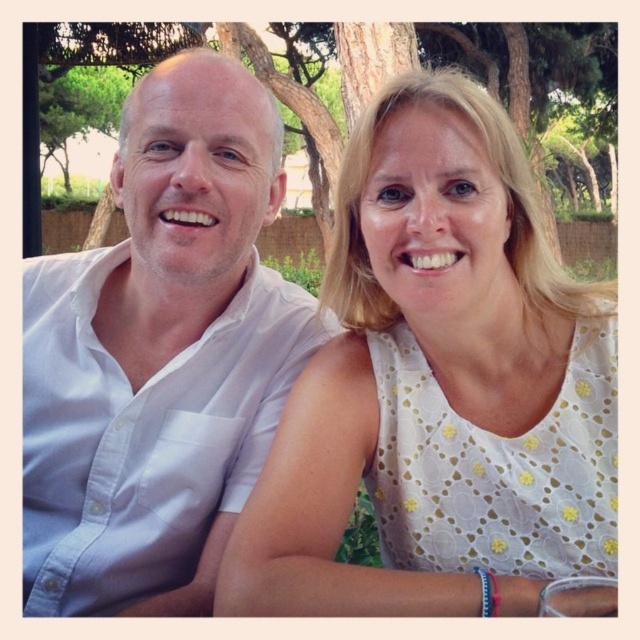
Is white cotton shirt at left to the left of green leafy tree at upper center from the viewer's perspective?

Yes, white cotton shirt at left is to the left of green leafy tree at upper center.

Is point (131, 148) in front of point (536, 150)?

Yes, point (131, 148) is in front of point (536, 150).

Identify the location of white cotton shirt at left. The image size is (640, 640). (160, 355).

Can you confirm if white dotted dress at center is positioned below white cotton shirt at left?

Indeed, white dotted dress at center is positioned under white cotton shirt at left.

Who is higher up, white dotted dress at center or white cotton shirt at left?

white cotton shirt at left is above.

At what (x,y) coordinates should I click in order to perform the action: click on white dotted dress at center. Please return your answer as a coordinate pair (x, y). Image resolution: width=640 pixels, height=640 pixels. Looking at the image, I should click on (440, 387).

Does white dotted dress at center appear on the left side of green leafy tree at upper center?

Indeed, white dotted dress at center is positioned on the left side of green leafy tree at upper center.

Does white dotted dress at center have a greater width compared to green leafy tree at upper center?

No.

You are a GUI agent. You are given a task and a screenshot of the screen. Output one action in this format:
    pyautogui.click(x=<x>, y=<y>)
    Task: Click on the white dotted dress at center
    
    Given the screenshot: What is the action you would take?
    pyautogui.click(x=440, y=387)

The height and width of the screenshot is (640, 640). In order to click on white dotted dress at center in this screenshot , I will do `click(440, 387)`.